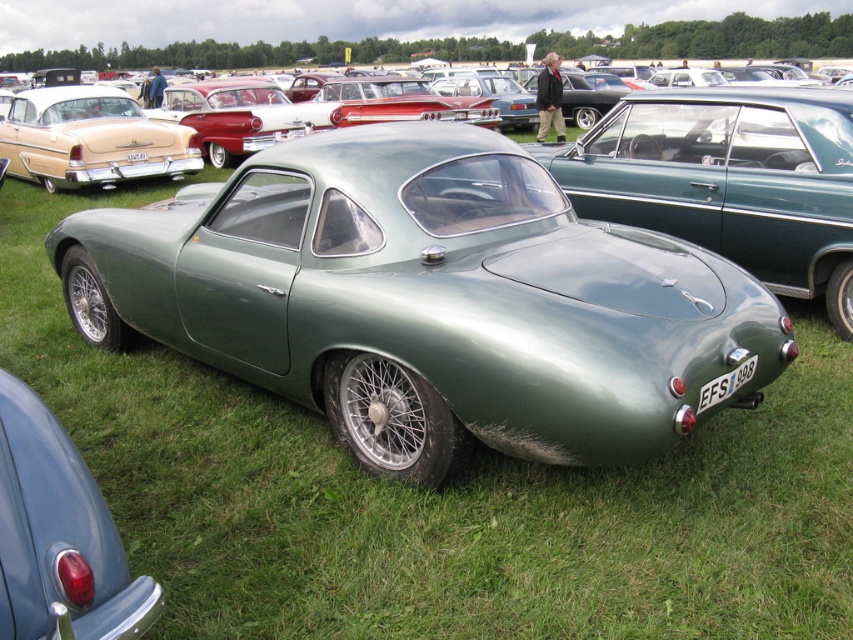
Question: From the image, what is the correct spatial relationship of metallic green car at center in relation to matte red taillight at lower left?

Choices:
 (A) right
 (B) left

Answer: (A)

Question: In this image, where is metallic green car at center located relative to matte red taillight at lower left?

Choices:
 (A) right
 (B) left

Answer: (A)

Question: Which point is farther from the camera taking this photo?

Choices:
 (A) (305, 122)
 (B) (12, 621)

Answer: (A)

Question: Among these points, which one is nearest to the camera?

Choices:
 (A) (144, 608)
 (B) (351, 102)

Answer: (A)

Question: Is metallic green car at center above matte red taillight at lower left?

Choices:
 (A) no
 (B) yes

Answer: (B)

Question: Which point is closer to the camera?

Choices:
 (A) matte red taillight at lower left
 (B) metallic green car at center

Answer: (A)